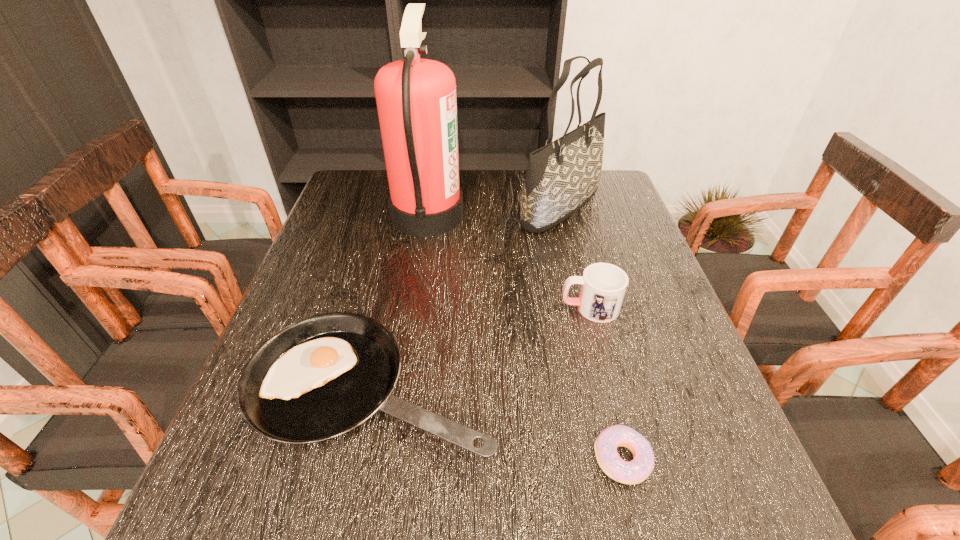
The image size is (960, 540). Find the location of `the tallest object`. the tallest object is located at coordinates 416,101.

This screenshot has height=540, width=960. I want to click on tote bag, so click(561, 177).

The image size is (960, 540). I want to click on the third shortest object, so click(603, 285).

You are a GUI agent. You are given a task and a screenshot of the screen. Output one action in this format:
    pyautogui.click(x=<x>, y=<y>)
    Task: Click on the third farthest object
    This screenshot has height=540, width=960.
    Given the screenshot: What is the action you would take?
    pyautogui.click(x=603, y=285)

Identify the location of frying pan. This screenshot has width=960, height=540. coord(322,376).

The height and width of the screenshot is (540, 960). In order to click on doughnut in this screenshot , I will do `click(635, 471)`.

In order to click on free location located 0.260m at the nozzle of the tallest object in this screenshot , I will do `click(556, 215)`.

Where is `vacant area located on the front of the fourth shortest object`? The image size is (960, 540). vacant area located on the front of the fourth shortest object is located at coordinates (580, 287).

This screenshot has width=960, height=540. What are the coordinates of `vacant region located on the side of the third farthest object with the handle` in the screenshot? It's located at (460, 307).

Identify the location of free point located 0.300m on the side of the third farthest object with the handle. This screenshot has width=960, height=540. (424, 307).